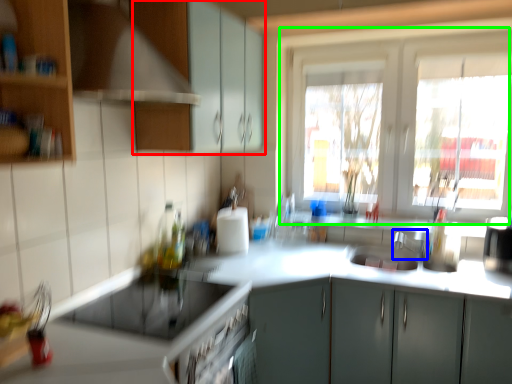
Question: Which object is the farthest from cabinetry (highlighted by a red box)? Choose among these: faucet (highlighted by a blue box) or window (highlighted by a green box).

Choices:
 (A) faucet
 (B) window

Answer: (A)